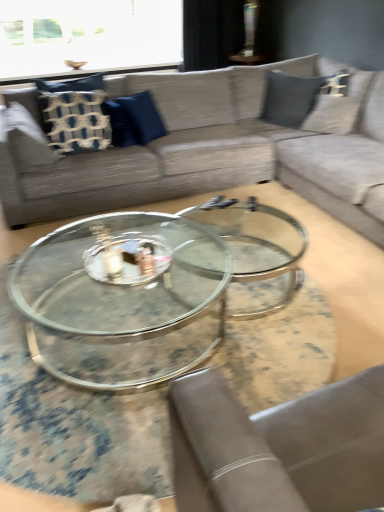
Question: From the image's perspective, would you say black fabric curtain at upper center is positioned over blue fabric pillow at center, placed as the 2th pillow when sorted from left to right?

Choices:
 (A) yes
 (B) no

Answer: (A)

Question: From a real-world perspective, is black fabric curtain at upper center under blue fabric pillow at center, which ranks as the first pillow in right-to-left order?

Choices:
 (A) no
 (B) yes

Answer: (A)

Question: Can you confirm if black fabric curtain at upper center is shorter than blue fabric pillow at center, placed as the 2th pillow when sorted from left to right?

Choices:
 (A) yes
 (B) no

Answer: (B)

Question: Is black fabric curtain at upper center positioned in front of blue fabric pillow at center, which ranks as the first pillow in right-to-left order?

Choices:
 (A) no
 (B) yes

Answer: (A)

Question: Is black fabric curtain at upper center not near blue fabric pillow at center, which ranks as the first pillow in right-to-left order?

Choices:
 (A) yes
 (B) no

Answer: (A)

Question: Choose the correct answer: Is blue fabric pillow at center, placed as the 2th pillow when sorted from left to right, inside black fabric curtain at upper center or outside it?

Choices:
 (A) outside
 (B) inside

Answer: (A)

Question: Looking at their shapes, would you say blue fabric pillow at center, placed as the 2th pillow when sorted from left to right, is wider or thinner than black fabric curtain at upper center?

Choices:
 (A) wide
 (B) thin

Answer: (B)

Question: Considering the positions of blue fabric pillow at center, placed as the 2th pillow when sorted from left to right, and black fabric curtain at upper center in the image, is blue fabric pillow at center, placed as the 2th pillow when sorted from left to right, bigger or smaller than black fabric curtain at upper center?

Choices:
 (A) big
 (B) small

Answer: (B)

Question: Visually, is blue fabric pillow at center, placed as the 2th pillow when sorted from left to right, positioned to the left or to the right of black fabric curtain at upper center?

Choices:
 (A) right
 (B) left

Answer: (B)

Question: Is point (284, 160) closer or farther from the camera than point (150, 135)?

Choices:
 (A) closer
 (B) farther

Answer: (A)

Question: From a real-world perspective, is textured gray couch at upper center above or below blue fabric pillow at center, placed as the 2th pillow when sorted from left to right?

Choices:
 (A) above
 (B) below

Answer: (B)

Question: Visually, is textured gray couch at upper center positioned to the left or to the right of blue fabric pillow at center, placed as the 2th pillow when sorted from left to right?

Choices:
 (A) right
 (B) left

Answer: (A)

Question: Looking at their shapes, would you say textured gray couch at upper center is wider or thinner than blue fabric pillow at center, which ranks as the first pillow in right-to-left order?

Choices:
 (A) thin
 (B) wide

Answer: (B)

Question: Do you think textured gray couch at upper center is within black fabric curtain at upper center, or outside of it?

Choices:
 (A) inside
 (B) outside

Answer: (B)

Question: Visually, is textured gray couch at upper center positioned to the left or to the right of black fabric curtain at upper center?

Choices:
 (A) left
 (B) right

Answer: (A)